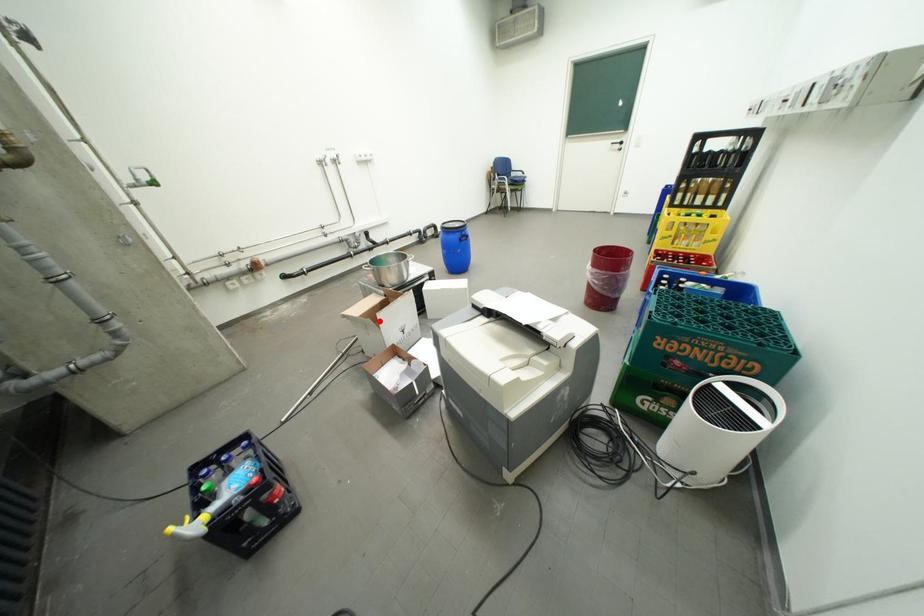
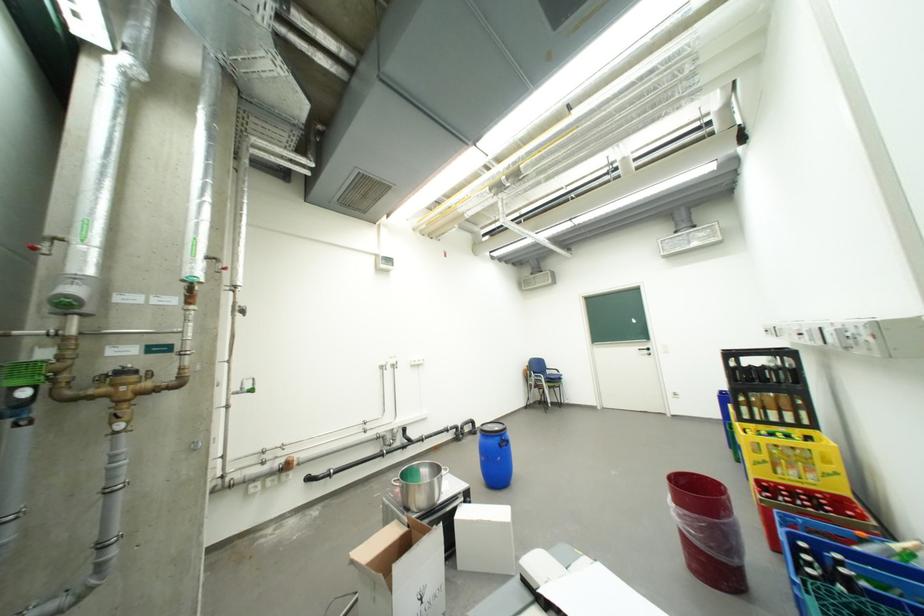
Question: I am providing you with two images of the same scene from different viewpoints. In image1, a red point is highlighted. Considering the same 3D point in image2, which of the following is correct?

Choices:
 (A) It is closer
 (B) It is farther

Answer: (B)